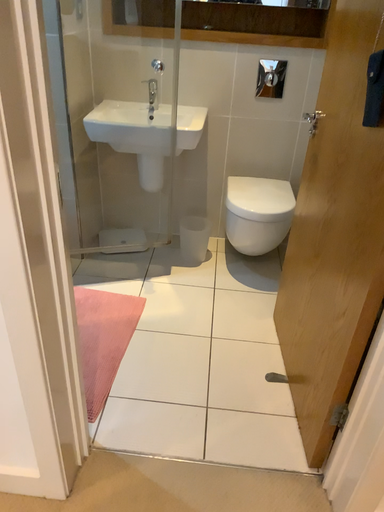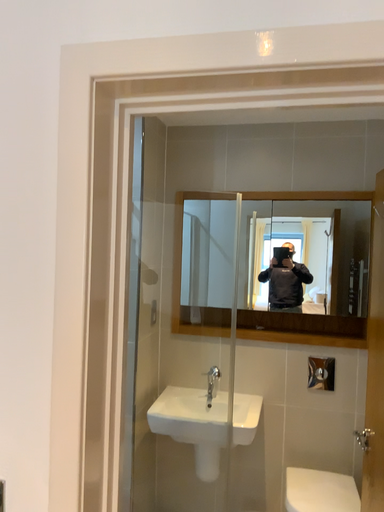
Question: How did the camera likely rotate when shooting the video?

Choices:
 (A) rotated right
 (B) rotated left

Answer: (B)